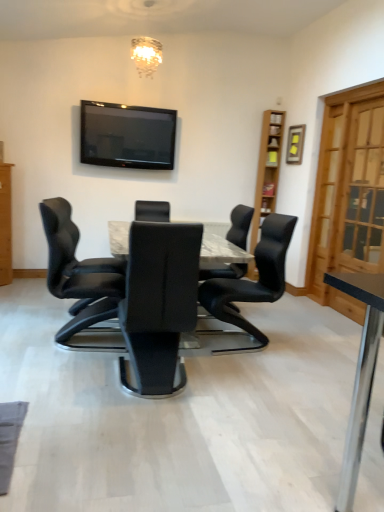
Question: From a real-world perspective, relative to light brown wooden cabinet at left, is black leather chair at center, acting as the 2th chair starting from the right, vertically above or below?

Choices:
 (A) below
 (B) above

Answer: (A)

Question: Considering the positions of point (200, 287) and point (3, 198), is point (200, 287) closer or farther from the camera than point (3, 198)?

Choices:
 (A) farther
 (B) closer

Answer: (B)

Question: Which object is the farthest from the flat-screen black at upper center?

Choices:
 (A) black leather chair at center, acting as the 2th chair starting from the right
 (B) black leather chair at center, which is the first chair from right to left
 (C) light brown wooden cabinet at left
 (D) clear glass door at right
 (E) black leather chair at left, arranged as the 1th chair when viewed from the left

Answer: (B)

Question: Estimate the real-world distances between objects in this image. Which object is closer to the light brown wooden cabinet at left?

Choices:
 (A) black leather chair at center, the third chair when ordered from left to right
 (B) wooden bookshelf at upper right
 (C) flat-screen black at upper center
 (D) clear glass door at right
 (E) marble table at center

Answer: (E)